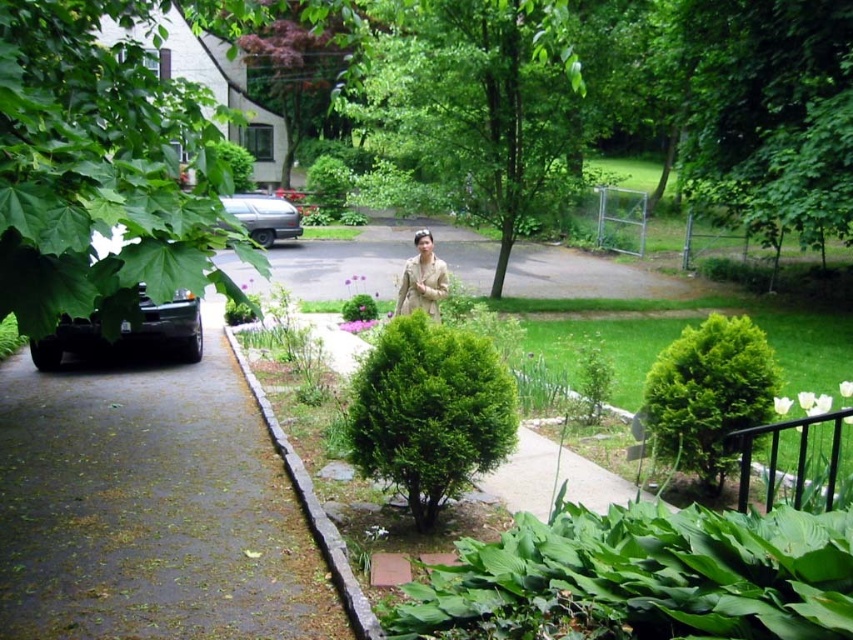
Is gray asphalt pavement at lower left in front of green textured bush at right?

Yes, it is in front of green textured bush at right.

Can you confirm if gray asphalt pavement at lower left is wider than green textured bush at right?

Incorrect, gray asphalt pavement at lower left's width does not surpass green textured bush at right's.

Is point (202, 612) farther from viewer compared to point (714, 429)?

No, it is in front of (714, 429).

You are a GUI agent. You are given a task and a screenshot of the screen. Output one action in this format:
    pyautogui.click(x=<x>, y=<y>)
    Task: Click on the gray asphalt pavement at lower left
    This screenshot has height=640, width=853.
    Given the screenshot: What is the action you would take?
    pyautogui.click(x=149, y=509)

Which is more to the left, green leafy tree at left or gray stone curb at center?

green leafy tree at left

Is green leafy tree at left positioned in front of gray stone curb at center?

Yes.

What do you see at coordinates (102, 168) in the screenshot?
I see `green leafy tree at left` at bounding box center [102, 168].

What are the coordinates of `green leafy tree at left` in the screenshot? It's located at (102, 168).

Between green leafy tree at left and tan fabric jacket at center, which one has more height?

green leafy tree at left

Can you confirm if green leafy tree at left is positioned above tan fabric jacket at center?

Indeed, green leafy tree at left is positioned over tan fabric jacket at center.

Identify the location of green leafy tree at left. The width and height of the screenshot is (853, 640). (102, 168).